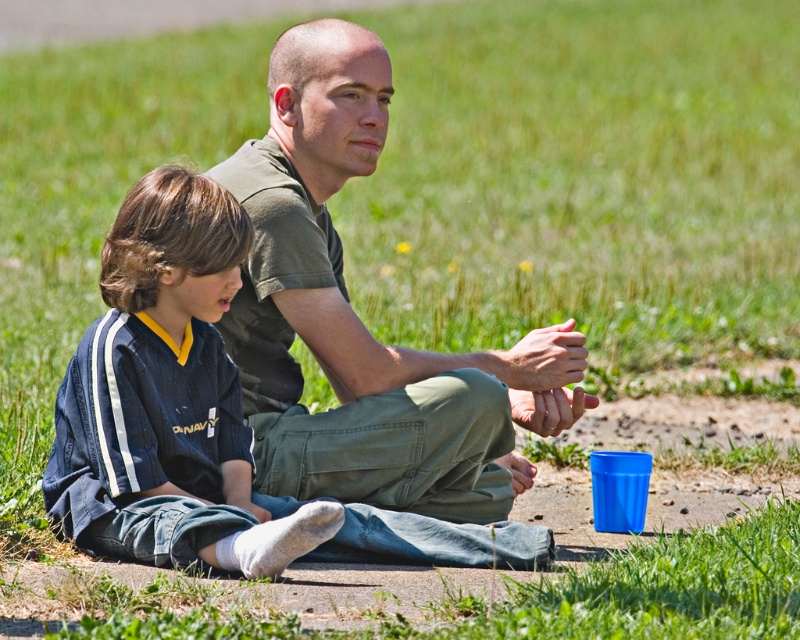
Question: Is matte green t-shirt at center bigger than dark blue jersey at center?

Choices:
 (A) no
 (B) yes

Answer: (B)

Question: Can you confirm if matte green t-shirt at center is positioned below dark blue jersey at center?

Choices:
 (A) no
 (B) yes

Answer: (A)

Question: Does matte green t-shirt at center appear on the right side of dark blue jersey at center?

Choices:
 (A) no
 (B) yes

Answer: (B)

Question: Which point is farther from the camera taking this photo?

Choices:
 (A) (320, 124)
 (B) (164, 548)

Answer: (A)